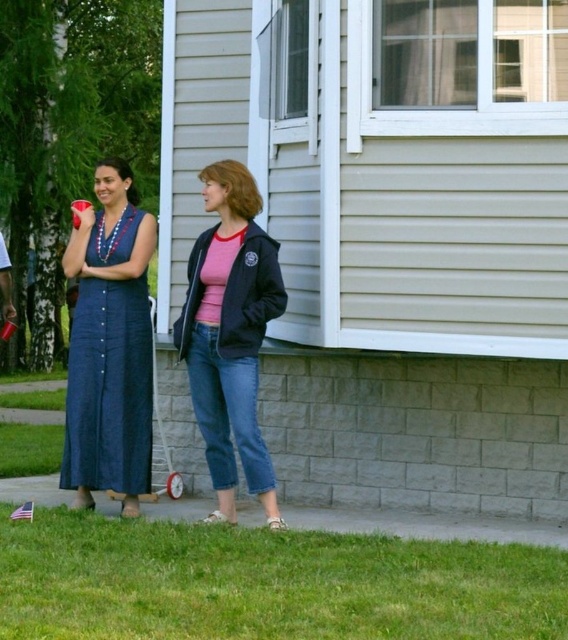
Is green grass at lower left shorter than matte black jacket at center?

Yes, green grass at lower left is shorter than matte black jacket at center.

The height and width of the screenshot is (640, 568). What do you see at coordinates (266, 582) in the screenshot? I see `green grass at lower left` at bounding box center [266, 582].

Where is `green grass at lower left`? This screenshot has width=568, height=640. green grass at lower left is located at coordinates (266, 582).

Does matte black jacket at center appear on the right side of denim dress at left?

Yes, matte black jacket at center is to the right of denim dress at left.

Which is behind, point (245, 333) or point (123, 356)?

The point (123, 356) is behind.

Which is in front, point (247, 200) or point (118, 374)?

Point (247, 200)

Image resolution: width=568 pixels, height=640 pixels. What are the coordinates of `matte black jacket at center` in the screenshot? It's located at (231, 333).

Does green grass at lower left have a greater height compared to denim dress at left?

Incorrect, green grass at lower left's height is not larger of denim dress at left's.

Who is positioned more to the left, green grass at lower left or denim dress at left?

denim dress at left

Measure the distance between point (173, 525) and camera.

They are 7.68 meters apart.

Locate an element on the screen. This screenshot has width=568, height=640. green grass at lower left is located at coordinates coord(266,582).